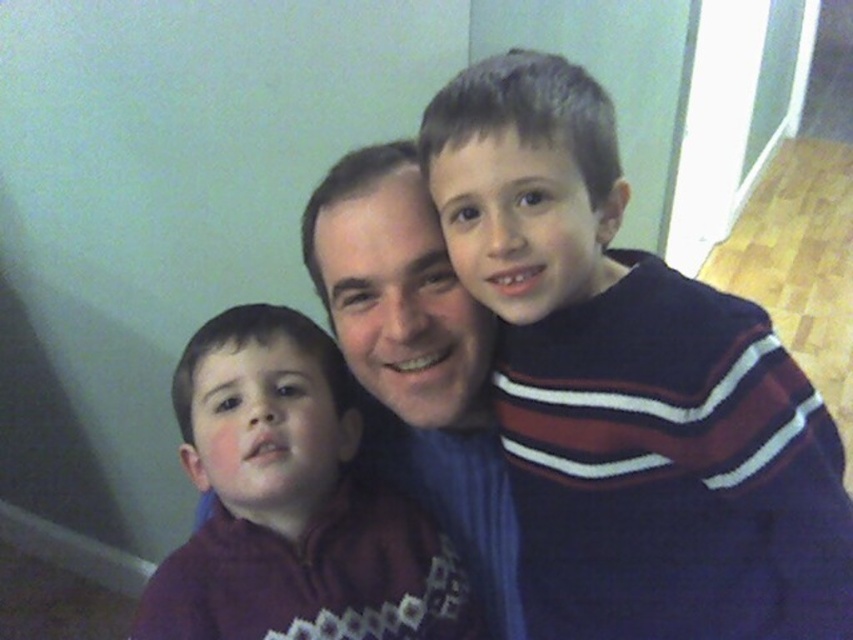
You are trying to decide which sweater is wider between the dark blue sweater at right and the matte blue sweater at center. According to the scene, which one is wider?

The dark blue sweater at right is wider than the matte blue sweater at center.

Based on the photo, you are standing in the room and want to reach the point marked at coordinates point (351,484). If you are currently 40 inches away from the point, can you take a single step forward to reach it?

The distance of point (351,484) from viewer is 38.53 inches. Since you are currently 40 inches away, taking a single step forward would reduce your distance to approximately 38.53 inches, which matches the required distance. Therefore, yes, you can reach the point with a single step forward.

You are standing in the room and see two points marked in the image. The first point is at coordinate point (x=840, y=467) and the second is at point (x=480, y=444). Which point is closer to you?

Point (x=840, y=467) is in front of point (x=480, y=444), so it is closer to you.